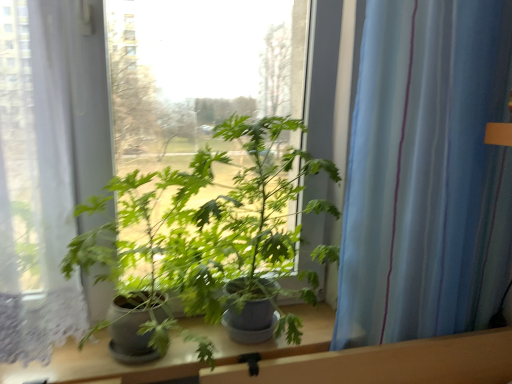
Question: Could you tell me if green matte plant at center is turned towards blue striped curtain at right?

Choices:
 (A) yes
 (B) no

Answer: (B)

Question: Is blue striped curtain at right completely or partially inside green matte plant at center?

Choices:
 (A) no
 (B) yes

Answer: (A)

Question: Can you confirm if green matte plant at center is positioned to the left of blue striped curtain at right?

Choices:
 (A) no
 (B) yes

Answer: (B)

Question: From the image's perspective, is green matte plant at center located beneath blue striped curtain at right?

Choices:
 (A) no
 (B) yes

Answer: (B)

Question: Is the position of green matte plant at center more distant than that of blue striped curtain at right?

Choices:
 (A) no
 (B) yes

Answer: (A)

Question: Is green matte plant at center at the right side of blue striped curtain at right?

Choices:
 (A) no
 (B) yes

Answer: (A)

Question: Can you confirm if blue striped curtain at right is wider than green matte plant at center?

Choices:
 (A) no
 (B) yes

Answer: (A)

Question: Is blue striped curtain at right oriented towards green matte plant at center?

Choices:
 (A) yes
 (B) no

Answer: (B)

Question: Can you confirm if blue striped curtain at right is thinner than green matte plant at center?

Choices:
 (A) no
 (B) yes

Answer: (B)

Question: Considering the relative positions of blue striped curtain at right and green matte plant at center in the image provided, is blue striped curtain at right behind green matte plant at center?

Choices:
 (A) no
 (B) yes

Answer: (B)

Question: Is blue striped curtain at right not near green matte plant at center?

Choices:
 (A) no
 (B) yes

Answer: (A)

Question: Considering the relative positions of blue striped curtain at right and green matte plant at center in the image provided, is blue striped curtain at right to the right of green matte plant at center from the viewer's perspective?

Choices:
 (A) no
 (B) yes

Answer: (B)

Question: Is blue striped curtain at right taller or shorter than green matte plant at center?

Choices:
 (A) tall
 (B) short

Answer: (A)